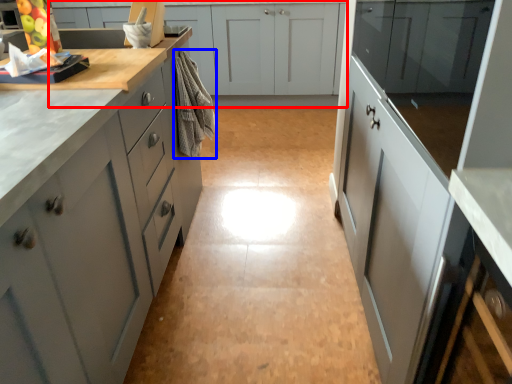
Question: Among these objects, which one is nearest to the camera, cabinetry (highlighted by a red box) or material (highlighted by a blue box)?

Choices:
 (A) cabinetry
 (B) material

Answer: (B)